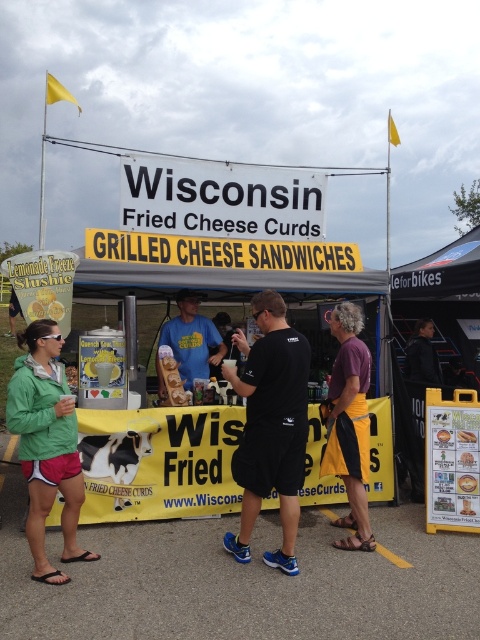
Question: Which of the following is the farthest from the observer?

Choices:
 (A) brown leather sandals at lower center
 (B) purple cotton shirt at center
 (C) black matte t-shirt at center
 (D) blue cotton shirt at center

Answer: (D)

Question: Which of these objects is positioned closest to the black matte t-shirt at center?

Choices:
 (A) green matte jacket at lower left
 (B) brown leather sandals at lower center
 (C) blue cotton shirt at center
 (D) purple cotton shirt at center

Answer: (D)

Question: Where is black matte t-shirt at center located in relation to purple cotton shirt at center in the image?

Choices:
 (A) below
 (B) above

Answer: (B)

Question: In this image, where is purple cotton shirt at center located relative to brown leather sandals at lower center?

Choices:
 (A) left
 (B) right

Answer: (A)

Question: Which of these objects is positioned farthest from the brown leather sandals at lower center?

Choices:
 (A) black matte t-shirt at center
 (B) blue cotton shirt at center

Answer: (B)

Question: Is black matte t-shirt at center above green matte jacket at lower left?

Choices:
 (A) no
 (B) yes

Answer: (B)